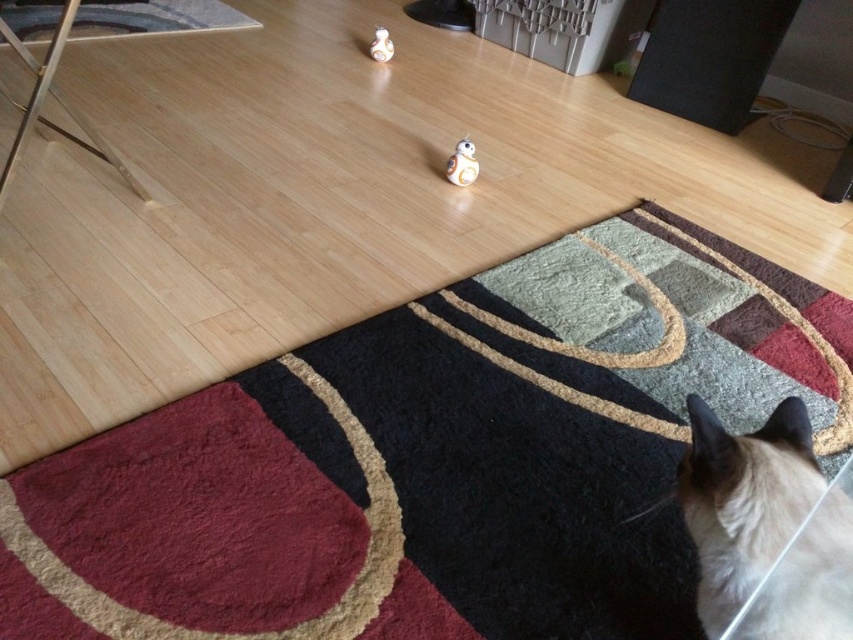
Question: Among these objects, which one is farthest from the camera?

Choices:
 (A) white plastic bb8 at center
 (B) white glossy figurine at upper center
 (C) black textured rug at upper left

Answer: (B)

Question: Can you confirm if textured wool mat at lower center is wider than black textured rug at upper left?

Choices:
 (A) yes
 (B) no

Answer: (A)

Question: Estimate the real-world distances between objects in this image. Which object is closer to the white glossy figurine at upper center?

Choices:
 (A) white plastic bb8 at center
 (B) black textured rug at upper left
 (C) textured wool mat at lower center
 (D) silky white cat at lower right

Answer: (A)

Question: Observing the image, what is the correct spatial positioning of white plastic bb8 at center in reference to white glossy figurine at upper center?

Choices:
 (A) left
 (B) right

Answer: (B)

Question: Where is textured wool mat at lower center located in relation to white glossy figurine at upper center in the image?

Choices:
 (A) left
 (B) right

Answer: (B)

Question: Which object is the closest to the white plastic bb8 at center?

Choices:
 (A) white glossy figurine at upper center
 (B) silky white cat at lower right
 (C) black textured rug at upper left
 (D) textured wool mat at lower center

Answer: (D)